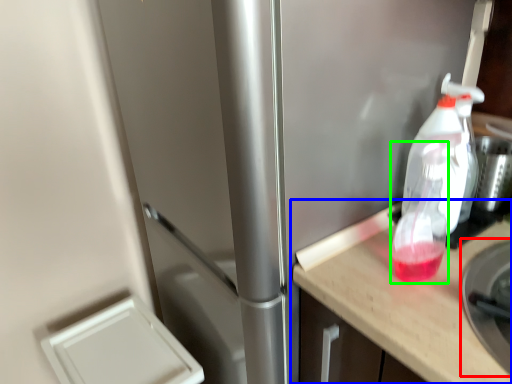
Question: Which object is positioned closest to appliance (highlighted by a red box)? Select from countertop (highlighted by a blue box) and bottle (highlighted by a green box).

Choices:
 (A) countertop
 (B) bottle

Answer: (A)